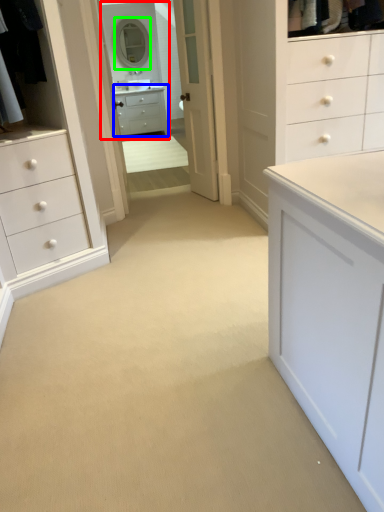
Question: Considering the real-world distances, which object is farthest from mirror (highlighted by a red box)? chest of drawers (highlighted by a blue box) or mirror (highlighted by a green box)?

Choices:
 (A) chest of drawers
 (B) mirror

Answer: (B)